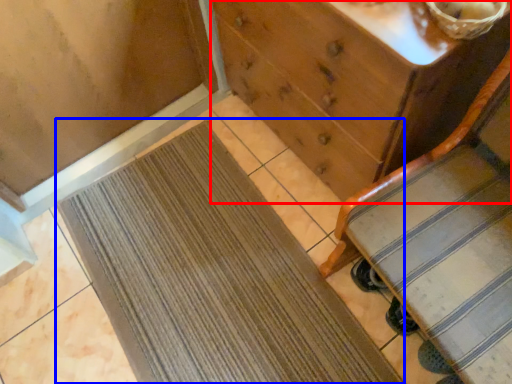
Question: Which point is further to the camera, chest of drawers (highlighted by a red box) or doormat (highlighted by a blue box)?

Choices:
 (A) chest of drawers
 (B) doormat

Answer: (B)